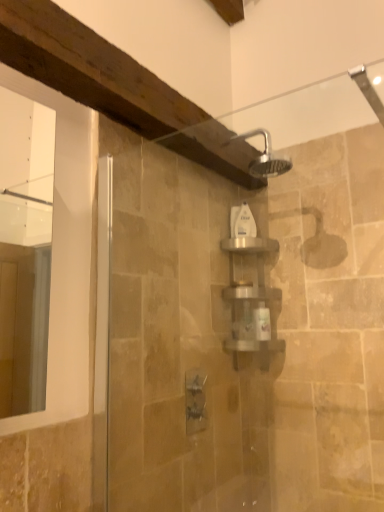
Where is `white plastic bottle at center`? The height and width of the screenshot is (512, 384). white plastic bottle at center is located at coordinates (242, 221).

The width and height of the screenshot is (384, 512). Describe the element at coordinates (242, 221) in the screenshot. I see `white plastic bottle at center` at that location.

At what (x,y) coordinates should I click in order to perform the action: click on satin silver shelf at center. Please return your answer as a coordinate pair (x, y). This screenshot has width=384, height=512. Looking at the image, I should click on (250, 298).

What do you see at coordinates (250, 298) in the screenshot? I see `satin silver shelf at center` at bounding box center [250, 298].

This screenshot has height=512, width=384. Identify the location of white plastic bottle at center. (242, 221).

Is white plastic bottle at center at the left side of satin silver shelf at center?

Correct, you'll find white plastic bottle at center to the left of satin silver shelf at center.

Which object is further away from the camera taking this photo, white plastic bottle at center or satin silver shelf at center?

white plastic bottle at center is further away from the camera.

Does point (230, 228) appear closer or farther from the camera than point (254, 338)?

Point (230, 228) is positioned farther from the camera compared to point (254, 338).

From the image's perspective, would you say white plastic bottle at center is positioned over satin silver shelf at center?

Yes, from the image's perspective, white plastic bottle at center is over satin silver shelf at center.

From a real-world perspective, relative to satin silver shelf at center, is white plastic bottle at center vertically above or below?

white plastic bottle at center is above satin silver shelf at center.

Is white plastic bottle at center wider or thinner than satin silver shelf at center?

Considering their sizes, white plastic bottle at center looks slimmer than satin silver shelf at center.

From their relative heights in the image, would you say white plastic bottle at center is taller or shorter than satin silver shelf at center?

Clearly, white plastic bottle at center is shorter compared to satin silver shelf at center.

Does white plastic bottle at center have a smaller size compared to satin silver shelf at center?

Yes.

Is satin silver shelf at center a part of white plastic bottle at center?

That's incorrect, satin silver shelf at center is not inside white plastic bottle at center.

Is there a large distance between white plastic bottle at center and satin silver shelf at center?

No, white plastic bottle at center is not far from satin silver shelf at center.

Is white plastic bottle at center aimed at satin silver shelf at center?

No, white plastic bottle at center is not oriented towards satin silver shelf at center.

How many degrees apart are the facing directions of white plastic bottle at center and satin silver shelf at center?

4.77 degrees separate the facing orientations of white plastic bottle at center and satin silver shelf at center.

Measure the distance between white plastic bottle at center and satin silver shelf at center.

They are 6.99 inches apart.

Locate an element on the screen. toiletry lying above the satin silver shelf at center (from the image's perspective) is located at coordinates (242, 221).

Based on their positions, is satin silver shelf at center located to the left or right of white plastic bottle at center?

Clearly, satin silver shelf at center is on the right of white plastic bottle at center in the image.

Which object is closer to the camera taking this photo, satin silver shelf at center or white plastic bottle at center?

Positioned in front is satin silver shelf at center.

Is point (233, 340) positioned behind point (255, 224)?

No, (233, 340) is closer to viewer.

From the image's perspective, between satin silver shelf at center and white plastic bottle at center, who is located below?

satin silver shelf at center.

From a real-world perspective, between satin silver shelf at center and white plastic bottle at center, who is vertically higher?

In real-world perspective, white plastic bottle at center is above.

Is satin silver shelf at center wider or thinner than white plastic bottle at center?

Considering their sizes, satin silver shelf at center looks broader than white plastic bottle at center.

Considering the relative sizes of satin silver shelf at center and white plastic bottle at center in the image provided, is satin silver shelf at center shorter than white plastic bottle at center?

No, satin silver shelf at center is not shorter than white plastic bottle at center.

Is satin silver shelf at center smaller than white plastic bottle at center?

No, satin silver shelf at center is not smaller than white plastic bottle at center.

Can white plastic bottle at center be found inside satin silver shelf at center?

Definitely not — white plastic bottle at center is not inside satin silver shelf at center.

Based on the photo, would you consider satin silver shelf at center to be distant from white plastic bottle at center?

No, satin silver shelf at center is not far from white plastic bottle at center.

Is satin silver shelf at center aimed at white plastic bottle at center?

No, satin silver shelf at center is not aimed at white plastic bottle at center.

Identify the location of toiletry behind the satin silver shelf at center. (242, 221).

This screenshot has width=384, height=512. There is a satin silver shelf at center. In order to click on toiletry above it (from a real-world perspective) in this screenshot , I will do `click(242, 221)`.

Find the location of a particular element. This screenshot has width=384, height=512. toiletry that appears above the satin silver shelf at center (from the image's perspective) is located at coordinates (242, 221).